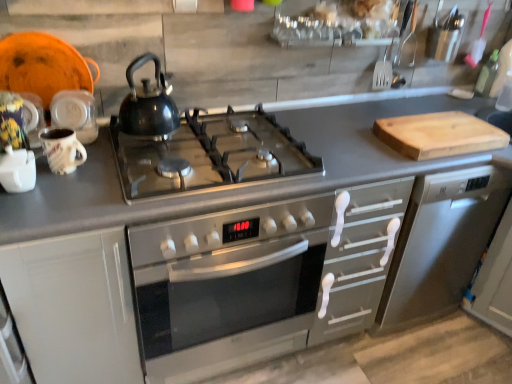
The height and width of the screenshot is (384, 512). What are the coordinates of `vacant space in front of glossy black kettle at center` in the screenshot? It's located at (159, 159).